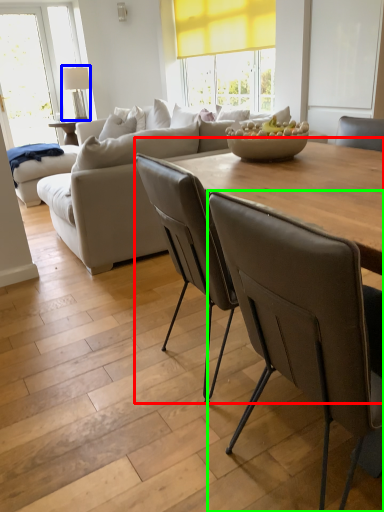
Question: Which object is the closest to the table (highlighted by a red box)? Choose among these: lamp (highlighted by a blue box) or chair (highlighted by a green box).

Choices:
 (A) lamp
 (B) chair

Answer: (B)